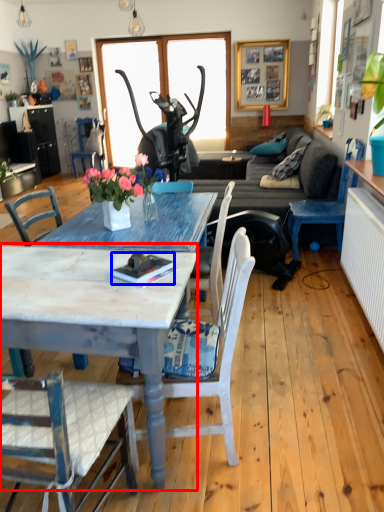
Question: Which of the following is the closest to the observer, coffee table (highlighted by a red box) or book (highlighted by a blue box)?

Choices:
 (A) coffee table
 (B) book

Answer: (A)